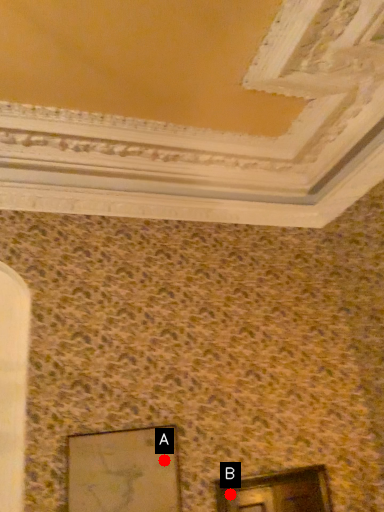
Question: Two points are circled on the image, labeled by A and B beside each circle. Which point is closer to the camera?

Choices:
 (A) A is closer
 (B) B is closer

Answer: (A)